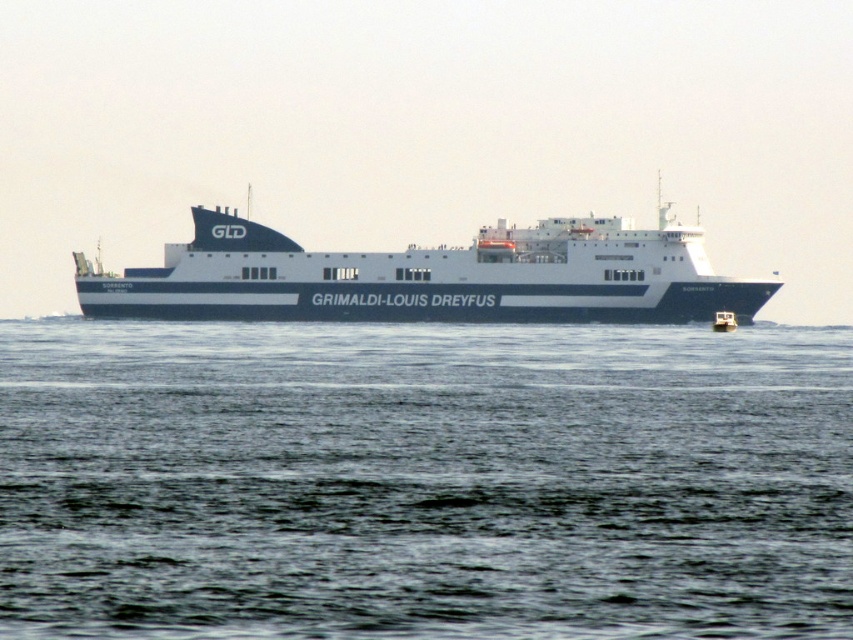
You are standing on the deck of the ferry GRIMALDI LOUIS DREYFUS and looking out at the scene. There is a point marked at coordinate [422,481]. What is located at that point?

The blue water at center is located at point [422,481].

You are a drone operator who needs to capture a photo of the blue water at center and the white matte ferry at center from above. The drone has a maximum camera range of 30 meters. Can the drone capture both objects in a single shot without moving?

The blue water at center is 30.42 meters from the white matte ferry at center. Since the distance exceeds the drone camera range of 30 meters, the drone cannot capture both objects in a single shot without moving.